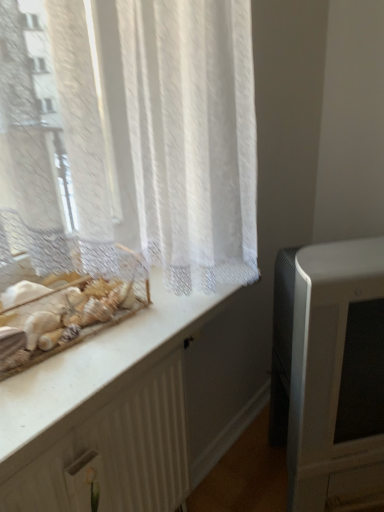
Question: Is white textured radiator at lower left in front of or behind matte white television at right in the image?

Choices:
 (A) front
 (B) behind

Answer: (A)

Question: From the image's perspective, is white textured radiator at lower left positioned above or below matte white television at right?

Choices:
 (A) above
 (B) below

Answer: (B)

Question: Estimate the real-world distances between objects in this image. Which object is closer to the matte white television at right?

Choices:
 (A) white marble counter at upper left
 (B) white textured radiator at lower left

Answer: (A)

Question: Which of these objects is positioned farthest from the white marble counter at upper left?

Choices:
 (A) white textured radiator at lower left
 (B) matte white television at right

Answer: (B)